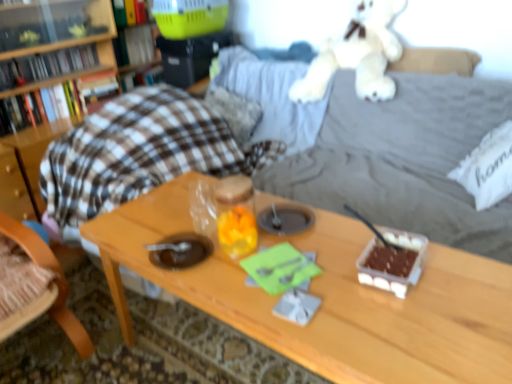
Question: Should I look upward or downward to see translucent plastic container with chocolate at right?

Choices:
 (A) down
 (B) up

Answer: (A)

Question: Is hardcover book at upper left, which ranks as the first book in top-to-bottom order, at the right side of wooden table at center?

Choices:
 (A) yes
 (B) no

Answer: (B)

Question: Is hardcover book at upper left, which is counted as the fourth book, starting from the bottom, not within wooden table at center?

Choices:
 (A) yes
 (B) no

Answer: (A)

Question: Are hardcover book at upper left, which ranks as the first book in top-to-bottom order, and wooden table at center located far from each other?

Choices:
 (A) yes
 (B) no

Answer: (A)

Question: Does hardcover book at upper left, which ranks as the first book in top-to-bottom order, have a lesser width compared to wooden table at center?

Choices:
 (A) no
 (B) yes

Answer: (B)

Question: Is the depth of hardcover book at upper left, which is counted as the fourth book, starting from the bottom, less than that of wooden table at center?

Choices:
 (A) yes
 (B) no

Answer: (B)

Question: Can you confirm if hardcover book at upper left, which ranks as the first book in top-to-bottom order, is shorter than wooden table at center?

Choices:
 (A) no
 (B) yes

Answer: (B)

Question: Is translucent plastic container with chocolate at right taller than hardcover book at upper left, which is the second book from bottom to top?

Choices:
 (A) no
 (B) yes

Answer: (A)

Question: From the image's perspective, is translucent plastic container with chocolate at right over hardcover book at upper left, the 3th book positioned from the top?

Choices:
 (A) no
 (B) yes

Answer: (A)

Question: Is translucent plastic container with chocolate at right thinner than hardcover book at upper left, which is the second book from bottom to top?

Choices:
 (A) no
 (B) yes

Answer: (A)

Question: Does translucent plastic container with chocolate at right have a smaller size compared to hardcover book at upper left, which is the second book from bottom to top?

Choices:
 (A) no
 (B) yes

Answer: (B)

Question: Can we say translucent plastic container with chocolate at right lies outside hardcover book at upper left, the 3th book positioned from the top?

Choices:
 (A) yes
 (B) no

Answer: (A)

Question: Considering the relative positions of translucent plastic container with chocolate at right and hardcover book at upper left, which is the second book from bottom to top, in the image provided, is translucent plastic container with chocolate at right to the left of hardcover book at upper left, which is the second book from bottom to top, from the viewer's perspective?

Choices:
 (A) no
 (B) yes

Answer: (A)

Question: Is wooden table at center bigger than wooden chair at left?

Choices:
 (A) yes
 (B) no

Answer: (A)